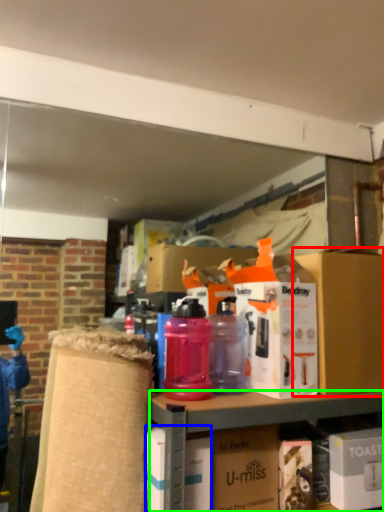
Question: Which is nearer to the box (highlighted by a red box)? box (highlighted by a blue box) or cabinetry (highlighted by a green box).

Choices:
 (A) box
 (B) cabinetry

Answer: (B)